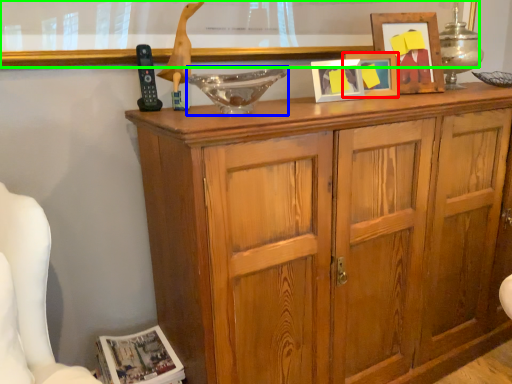
Question: Estimate the real-world distances between objects in this image. Which object is closer to picture frame (highlighted by a red box), glass bowl (highlighted by a blue box) or bulletin board (highlighted by a green box)?

Choices:
 (A) glass bowl
 (B) bulletin board

Answer: (B)